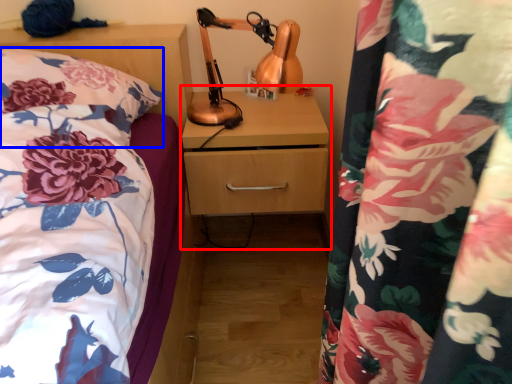
Question: Which object appears farthest to the camera in this image, dresser (highlighted by a red box) or pillow (highlighted by a blue box)?

Choices:
 (A) dresser
 (B) pillow

Answer: (A)